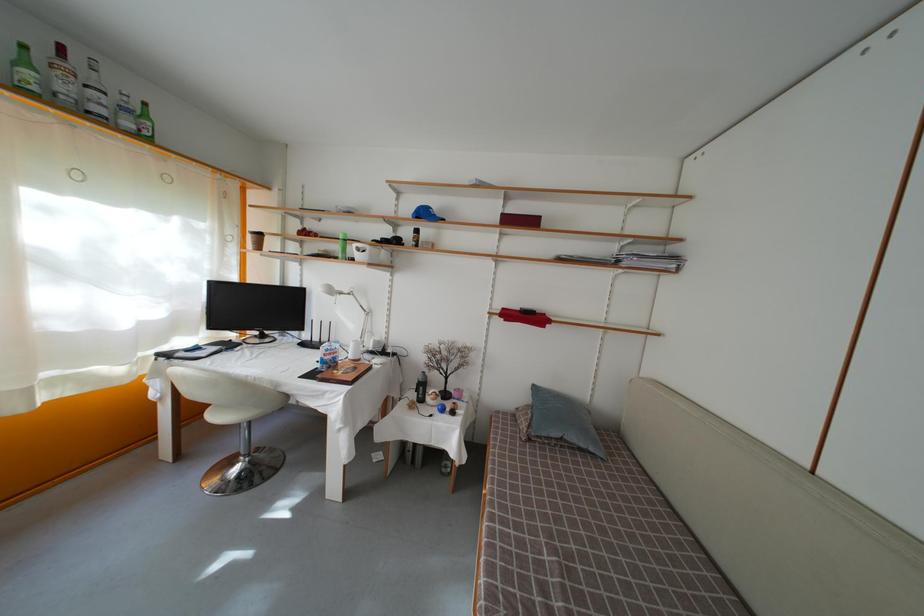
Describe the element at coordinates (256, 238) in the screenshot. Image resolution: width=924 pixels, height=616 pixels. I see `a brown paper cup` at that location.